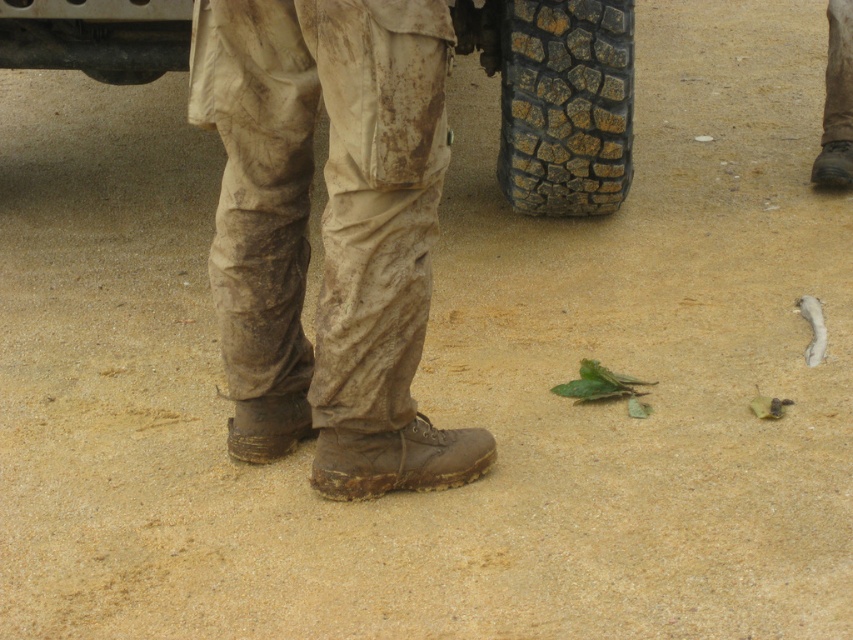
You are standing at point (357, 356) and want to walk to the vehicle in the background. Is point (401, 474) between you and the vehicle?

Yes, point (401, 474) is between you and the vehicle because point (357, 356) is in front of point (401, 474), which is closer to the vehicle.

You are a photographer trying to capture both the brown rugged boot at lower center and the black rubber tire at lower center in a single frame. Given their sizes, which object should you focus on first to ensure both fit in the frame?

The brown rugged boot at lower center is smaller than the black rubber tire at lower center, so you should focus on the black rubber tire at lower center first to ensure both fit in the frame.

You are a photographer trying to capture the brown rugged boot at lower center and the black rubber tire at lower center in the same frame. Based on their positions, which object would appear closer to the camera in the photo?

The brown rugged boot at lower center appears closer to the camera because it is positioned below the black rubber tire at lower center, indicating it is in the foreground.